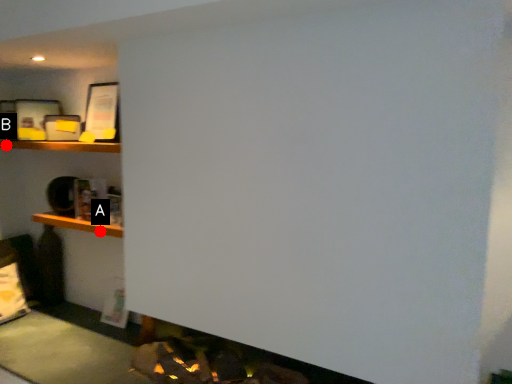
Question: Two points are circled on the image, labeled by A and B beside each circle. Which point is farther from the camera taking this photo?

Choices:
 (A) A is further
 (B) B is further

Answer: (B)